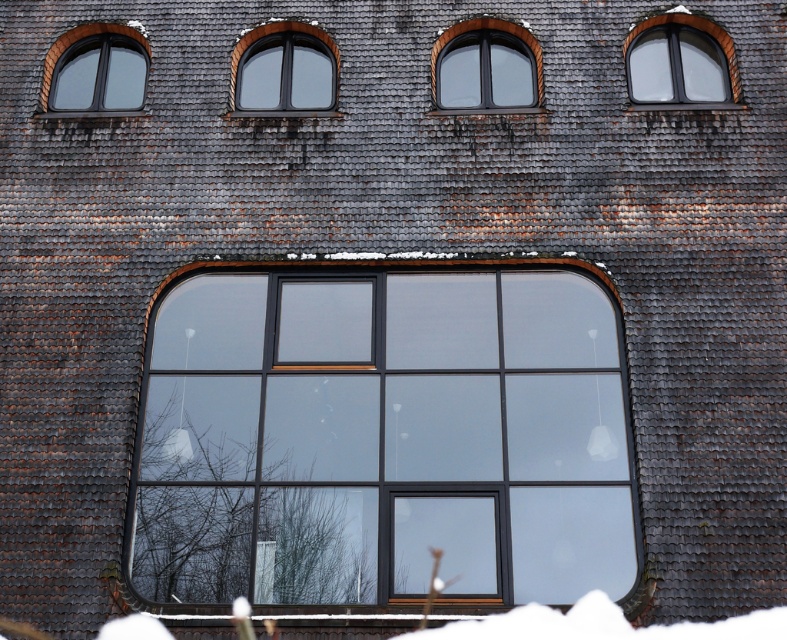
Who is more distant from viewer, (x=536, y=307) or (x=283, y=38)?

The point (x=283, y=38) is more distant.

Does black glass window at center have a greater height compared to matte black window at upper center?

Correct, black glass window at center is much taller as matte black window at upper center.

Find the location of a particular element. This screenshot has height=640, width=787. black glass window at center is located at coordinates (383, 440).

Identify the location of black glass window at center. This screenshot has height=640, width=787. (383, 440).

Measure the distance between matte glass window at upper center and matte black window at upper right.

A distance of 1.58 meters exists between matte glass window at upper center and matte black window at upper right.

Is point (478, 92) closer to viewer compared to point (675, 65)?

No, it is not.

This screenshot has width=787, height=640. In order to click on matte glass window at upper center in this screenshot , I will do `click(486, 65)`.

This screenshot has height=640, width=787. I want to click on matte black window at upper right, so click(x=678, y=60).

Is point (704, 28) closer to viewer compared to point (117, 88)?

Yes, point (704, 28) is closer to viewer.

Where is `matte black window at upper right`? The image size is (787, 640). matte black window at upper right is located at coordinates (678, 60).